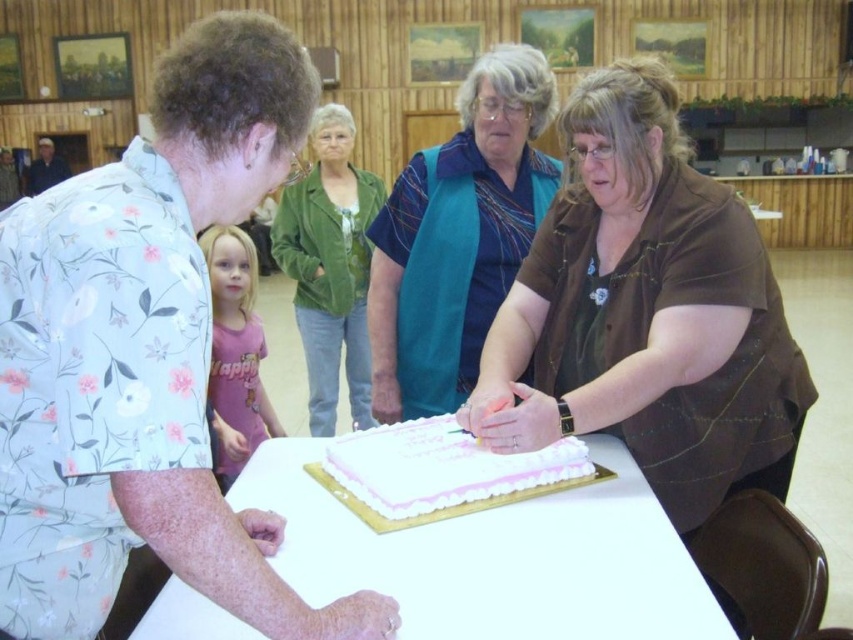
You are planning to place a rectangular cake on the white glossy table at center. The matte brown shirt at center is currently on the table. Can the cake fit on the table without overlapping the shirt?

The matte brown shirt at center has a smaller width than the white glossy table at center. Therefore, the cake can be placed on the table without overlapping the shirt as there is enough space.

You are attending a gathering and want to know which clothing item is shorter between the blue fabric vest at center and the green suede jacket at upper center. Can you tell me?

The blue fabric vest at center has a lesser height compared to the green suede jacket at upper center, so the blue fabric vest at center is shorter.

You are a server at the event and need to deliver a tray of drinks to the green suede jacket at upper center from the white glossy table at center. The tray is 1.8 meters long. Can you carry it horizontally without it extending beyond the space between them?

The distance between the white glossy table at center and green suede jacket at upper center is 2.17 meters. Since the tray is 1.8 meters long, it can be carried horizontally as the available space is wider than the tray.